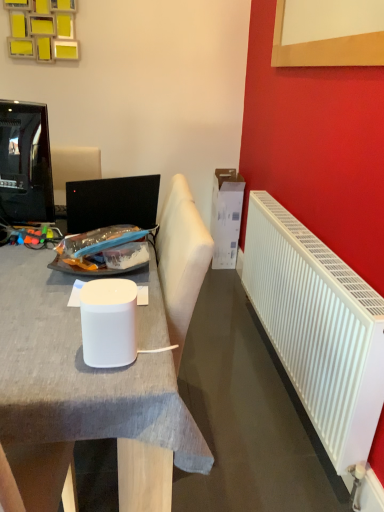
Question: From a real-world perspective, relative to white glossy paper cup at center, is white plastic radiator at right vertically above or below?

Choices:
 (A) below
 (B) above

Answer: (A)

Question: In terms of width, does white plastic radiator at right look wider or thinner when compared to white glossy paper cup at center?

Choices:
 (A) wide
 (B) thin

Answer: (A)

Question: Estimate the real-world distances between objects in this image. Which object is closer to the white matte desk at center?

Choices:
 (A) white plastic radiator at right
 (B) white glossy paper cup at center
 (C) matte black television at left
 (D) white cardboard box at upper right

Answer: (B)

Question: Estimate the real-world distances between objects in this image. Which object is closer to the matte black television at left?

Choices:
 (A) white cardboard box at upper right
 (B) white glossy paper cup at center
 (C) white matte desk at center
 (D) white plastic radiator at right

Answer: (C)